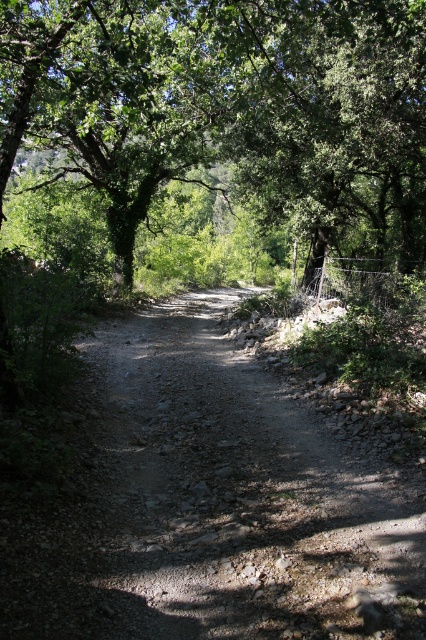
Between dusty gravel path at center and green leafy tree at center, which one has more height?

Standing taller between the two is green leafy tree at center.

Is dusty gravel path at center shorter than green leafy tree at center?

Yes, dusty gravel path at center is shorter than green leafy tree at center.

Where is `dusty gravel path at center`? The height and width of the screenshot is (640, 426). dusty gravel path at center is located at coordinates (210, 502).

Find the location of a particular element. The height and width of the screenshot is (640, 426). dusty gravel path at center is located at coordinates (210, 502).